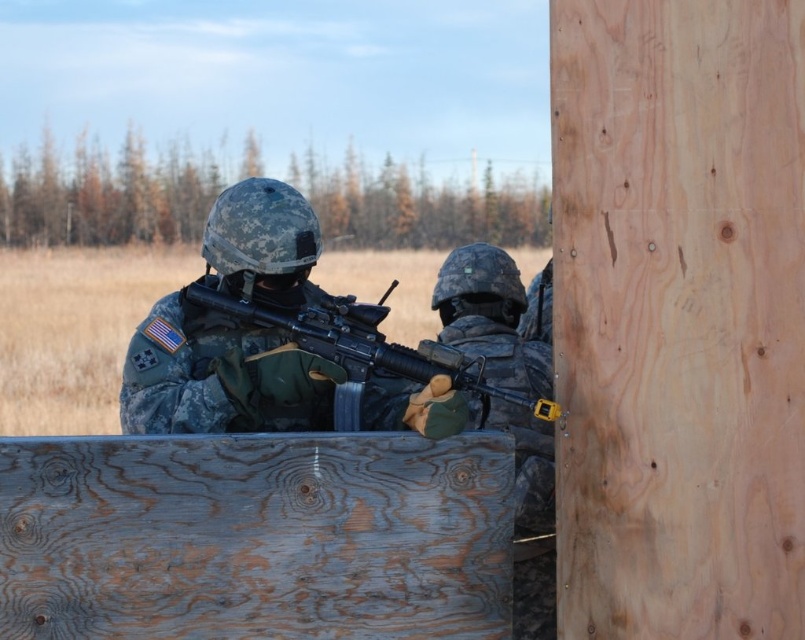
You are a photographer trying to capture a clear shot of the camouflage fabric rifle at center. If your camera has a minimum focus distance of 10 feet, will you need to move closer or farther away to ensure the rifle is in focus?

The camouflage fabric rifle at center is 9.34 feet from the camera, which is within the minimum focus distance of 10 feet. Therefore, you need to move farther away to ensure the rifle is in focus.

You are a military trainee who needs to determine which rifle is easier to carry during a long march. Based on the image, which rifle between the camouflage fabric rifle at center and the matte black rifle at center would you choose and why?

The camouflage fabric rifle at center is thinner than the matte black rifle at center, so it would be easier to carry during a long march due to its slimmer profile.